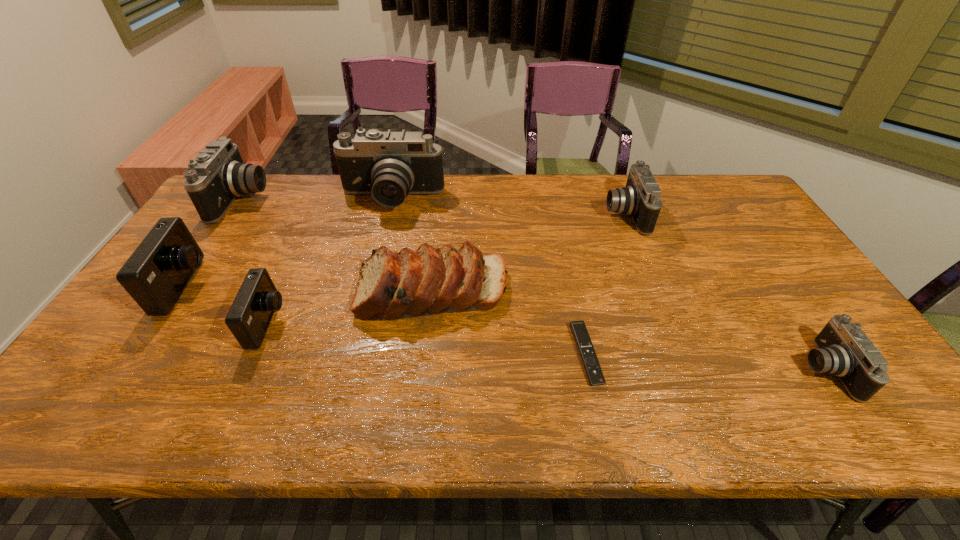
The image size is (960, 540). I want to click on vacant area at the far edge of the desktop, so click(680, 175).

Identify the location of free space at the near edge of the desktop. (150, 397).

Locate an element on the screen. This screenshot has width=960, height=540. free space at the right edge of the desktop is located at coordinates (739, 249).

At what (x,y) coordinates should I click in order to perform the action: click on vacant space at the near left corner of the desktop. Please return your answer as a coordinate pair (x, y). This screenshot has height=540, width=960. Looking at the image, I should click on (95, 411).

In the image, there is a desktop. Identify the location of vacant space at the far right corner. (732, 207).

The width and height of the screenshot is (960, 540). Find the location of `free spot between the bread and the bigger blue camera`. free spot between the bread and the bigger blue camera is located at coordinates tap(309, 288).

Image resolution: width=960 pixels, height=540 pixels. I want to click on vacant space that is in between the second tallest object and the third object from left to right, so click(x=255, y=261).

The height and width of the screenshot is (540, 960). I want to click on empty space that is in between the rightmost object and the remote control, so (706, 362).

This screenshot has width=960, height=540. Find the location of `free space that is in between the smaller blue camera and the bigger blue camera`. free space that is in between the smaller blue camera and the bigger blue camera is located at coordinates (227, 305).

This screenshot has height=540, width=960. I want to click on free point between the remote control and the left blue camera, so click(x=386, y=320).